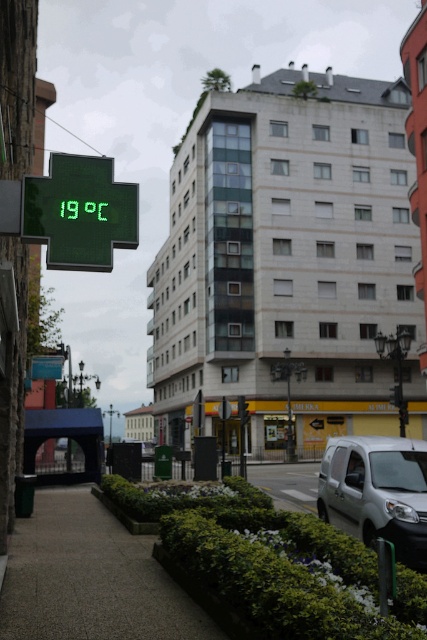
From the picture: You are standing at the point marked as point (274, 563) in the image. What object is directly in front of you?

The green leafy shrubs at lower center is located at point (274, 563), so the object directly in front of you is the green leafy shrubs at lower center.

You are a delivery person who needs to park your silver metallic van at center in a spot that is to the left of the green electronic display at upper left. Is your current position suitable for parking?

The silver metallic van at center is positioned on the right side of green electronic display at upper left, so it is currently not parked to the left of the display. Move the van to the left of the green electronic display at upper left to meet the requirement.

You are a pedestrian standing on the sidewalk and see the green leafy shrubs at lower center and the green electronic display at upper left. Which object is closer to you?

The green leafy shrubs at lower center are closer to you because they are positioned in front of the green electronic display at upper left.